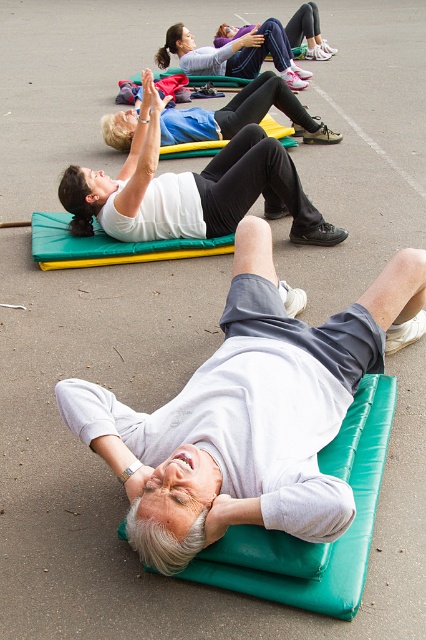
Question: Which of the following is the closest to the observer?

Choices:
 (A) (252, 147)
 (B) (302, 328)
 (C) (368, 396)
 (D) (282, 28)

Answer: (B)

Question: Does teal leather yoga mat at lower center come in front of matte purple leggings at upper center?

Choices:
 (A) no
 (B) yes

Answer: (B)

Question: Which point is farther to the camera?

Choices:
 (A) (316, 214)
 (B) (357, 532)
 (C) (285, 54)

Answer: (C)

Question: Which point appears closest to the camera in this image?

Choices:
 (A) (288, 60)
 (B) (380, 384)
 (C) (271, 477)

Answer: (C)

Question: Is gray fabric mat at lower center to the right of teal leather yoga mat at lower center from the viewer's perspective?

Choices:
 (A) no
 (B) yes

Answer: (A)

Question: Does teal leather yoga mat at lower center have a greater width compared to matte white shirt at upper center?

Choices:
 (A) no
 (B) yes

Answer: (A)